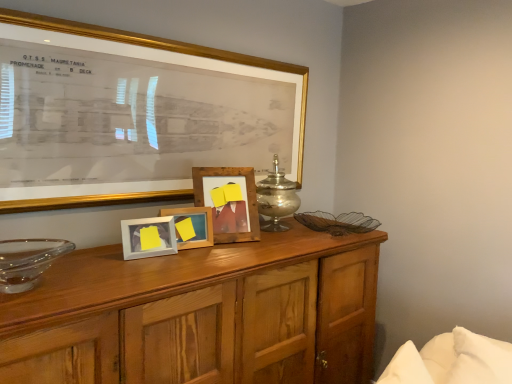
This screenshot has width=512, height=384. I want to click on free space in front of wooden photo frame at center, marked as the second picture frame in a back-to-front arrangement, so click(x=182, y=253).